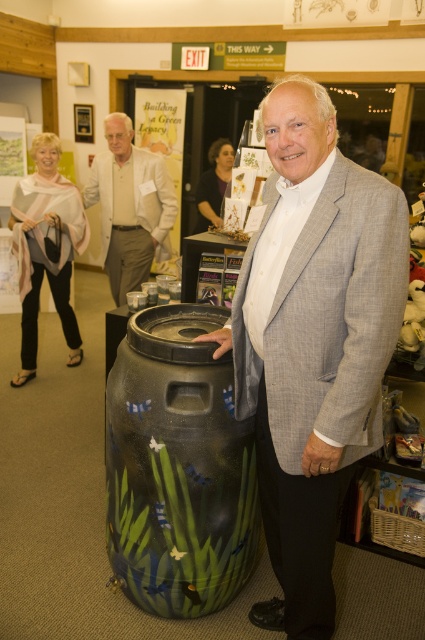
Question: Estimate the real-world distances between objects in this image. Which object is farther from the white textured suit at center?

Choices:
 (A) light gray scarf at left
 (B) painted ceramic barrel at center
 (C) gray wool suit at center

Answer: (C)

Question: Does gray wool suit at center lie behind light gray scarf at left?

Choices:
 (A) no
 (B) yes

Answer: (A)

Question: Considering the real-world distances, which object is closest to the painted ceramic barrel at center?

Choices:
 (A) gray wool suit at center
 (B) white textured suit at center
 (C) light gray scarf at left

Answer: (A)

Question: Which point is closer to the camera?

Choices:
 (A) painted ceramic barrel at center
 (B) light gray scarf at left
 (C) gray wool suit at center

Answer: (C)

Question: From the image, what is the correct spatial relationship of painted ceramic barrel at center in relation to light gray scarf at left?

Choices:
 (A) above
 (B) below

Answer: (B)

Question: Can you confirm if painted ceramic barrel at center is positioned above light gray scarf at left?

Choices:
 (A) no
 (B) yes

Answer: (A)